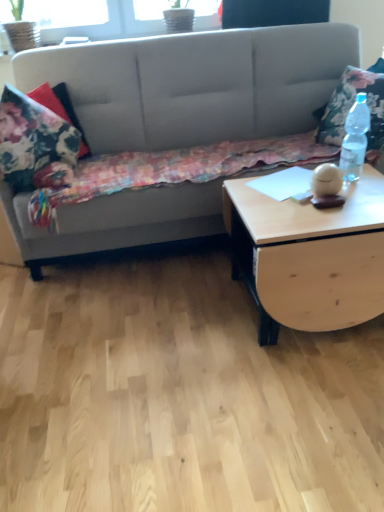
Where is `floral fabric blanket at left`? floral fabric blanket at left is located at coordinates (175, 170).

What is the approximate height of floral fabric pillow at right?

floral fabric pillow at right is 53.79 centimeters in height.

This screenshot has width=384, height=512. Describe the element at coordinates (35, 144) in the screenshot. I see `floral fabric pillow at left` at that location.

The height and width of the screenshot is (512, 384). I want to click on light wood/texture coffee table at right, so click(309, 255).

What do you see at coordinates (197, 84) in the screenshot?
I see `suede gray couch at upper left` at bounding box center [197, 84].

The width and height of the screenshot is (384, 512). I want to click on floral fabric blanket at left, so click(175, 170).

Considering the positions of objects suede gray couch at upper left and floral fabric blanket at left in the image provided, who is more to the right, suede gray couch at upper left or floral fabric blanket at left?

suede gray couch at upper left is more to the right.

Is suede gray couch at upper left thinner than floral fabric blanket at left?

No.

Locate an element on the screen. The width and height of the screenshot is (384, 512). studio couch on the right of floral fabric blanket at left is located at coordinates (197, 84).

Does suede gray couch at upper left lie behind floral fabric blanket at left?

No, suede gray couch at upper left is closer to the camera.

Is light wood/texture coffee table at right oriented towards suede gray couch at upper left?

No, light wood/texture coffee table at right does not turn towards suede gray couch at upper left.

Considering the sizes of objects light wood/texture coffee table at right and suede gray couch at upper left in the image provided, who is wider, light wood/texture coffee table at right or suede gray couch at upper left?

Wider between the two is suede gray couch at upper left.

Based on the photo, from the image's perspective, which object appears higher, light wood/texture coffee table at right or suede gray couch at upper left?

suede gray couch at upper left is shown above in the image.

Is light wood/texture coffee table at right positioned far away from suede gray couch at upper left?

No, light wood/texture coffee table at right is not far away from suede gray couch at upper left.

Based on the photo, is floral fabric pillow at left looking in the opposite direction of suede gray couch at upper left?

Yes, suede gray couch at upper left is at the back of floral fabric pillow at left.

Considering the relative positions of floral fabric pillow at left and suede gray couch at upper left in the image provided, is floral fabric pillow at left to the left or to the right of suede gray couch at upper left?

Clearly, floral fabric pillow at left is on the left of suede gray couch at upper left in the image.

From a real-world perspective, between floral fabric pillow at left and suede gray couch at upper left, who is vertically higher?

From a 3D spatial view, floral fabric pillow at left is above.

Is point (55, 121) more distant than point (121, 129)?

No, it is not.

Does point (371, 117) come closer to viewer compared to point (46, 113)?

That is True.

From a real-world perspective, which is physically below, floral fabric pillow at right or floral fabric pillow at left?

In real-world perspective, floral fabric pillow at left is lower.

Would you consider floral fabric pillow at right to be distant from floral fabric pillow at left?

Absolutely, floral fabric pillow at right is distant from floral fabric pillow at left.

In the scene shown: Is floral fabric pillow at right wider or thinner than floral fabric pillow at left?

Clearly, floral fabric pillow at right has less width compared to floral fabric pillow at left.

Does light wood/texture coffee table at right have a lesser width compared to floral fabric blanket at left?

Yes.

From a real-world perspective, relative to floral fabric blanket at left, is light wood/texture coffee table at right vertically above or below?

Clearly, from a real-world perspective, light wood/texture coffee table at right is below floral fabric blanket at left.

Considering the relative positions of floral fabric pillow at right and clear plastic bottle at right in the image provided, is floral fabric pillow at right to the left or to the right of clear plastic bottle at right?

floral fabric pillow at right is to the right of clear plastic bottle at right.

From a real-world perspective, is floral fabric pillow at right physically located above or below clear plastic bottle at right?

From a real-world perspective, floral fabric pillow at right is physically above clear plastic bottle at right.

Can we say floral fabric pillow at right lies outside clear plastic bottle at right?

floral fabric pillow at right lies outside clear plastic bottle at right's area.

You are a GUI agent. You are given a task and a screenshot of the screen. Output one action in this format:
    pyautogui.click(x=<x>, y=<y>)
    Task: Click on the coffee table in front of the floral fabric pillow at left
    This screenshot has width=384, height=512.
    Given the screenshot: What is the action you would take?
    pyautogui.click(x=309, y=255)

Is light wood/texture coffee table at right not within floral fabric pillow at left?

Yes, light wood/texture coffee table at right is not within floral fabric pillow at left.

Looking at this image, considering the sizes of objects light wood/texture coffee table at right and floral fabric pillow at left in the image provided, who is taller, light wood/texture coffee table at right or floral fabric pillow at left?

light wood/texture coffee table at right is taller.

Identify the location of studio couch located above the floral fabric blanket at left (from a real-world perspective). (197, 84).

The width and height of the screenshot is (384, 512). What are the coordinates of `coffee table lying in front of the suede gray couch at upper left` in the screenshot? It's located at (309, 255).

From the image, which object appears to be farther from suede gray couch at upper left, clear plastic bottle at right or floral fabric pillow at right?

clear plastic bottle at right is further to suede gray couch at upper left.

Which object lies further to the anchor point clear plastic bottle at right, floral fabric pillow at right or light wood/texture coffee table at right?

The object further to clear plastic bottle at right is floral fabric pillow at right.

Estimate the real-world distances between objects in this image. Which object is further from light wood/texture coffee table at right, floral fabric pillow at right or suede gray couch at upper left?

The object further to light wood/texture coffee table at right is suede gray couch at upper left.

Based on their spatial positions, is light wood/texture coffee table at right or floral fabric blanket at left further from floral fabric pillow at left?

Based on the image, light wood/texture coffee table at right appears to be further to floral fabric pillow at left.

Which object lies nearer to the anchor point floral fabric pillow at left, suede gray couch at upper left or clear plastic bottle at right?

suede gray couch at upper left is positioned closer to the anchor floral fabric pillow at left.

When comparing their distances from floral fabric pillow at right, does floral fabric blanket at left or floral fabric pillow at left seem further?

Among the two, floral fabric pillow at left is located further to floral fabric pillow at right.

Which object lies nearer to the anchor point floral fabric pillow at left, floral fabric blanket at left or suede gray couch at upper left?

The object closer to floral fabric pillow at left is floral fabric blanket at left.

When comparing their distances from floral fabric blanket at left, does floral fabric pillow at right or light wood/texture coffee table at right seem closer?

floral fabric pillow at right.

The height and width of the screenshot is (512, 384). Find the location of `coffee table between floral fabric pillow at left and clear plastic bottle at right`. coffee table between floral fabric pillow at left and clear plastic bottle at right is located at coordinates click(x=309, y=255).

You are a GUI agent. You are given a task and a screenshot of the screen. Output one action in this format:
    pyautogui.click(x=<x>, y=<y>)
    Task: Click on the bottle that lies between floral fabric pillow at right and light wood/texture coffee table at right from top to bottom
    Image resolution: width=384 pixels, height=512 pixels.
    Given the screenshot: What is the action you would take?
    pyautogui.click(x=355, y=139)

Find the location of a particular element. This screenshot has height=512, width=384. blanket situated between floral fabric pillow at left and clear plastic bottle at right from left to right is located at coordinates (175, 170).

This screenshot has height=512, width=384. Identify the location of studio couch between floral fabric pillow at right and light wood/texture coffee table at right from top to bottom. (197, 84).